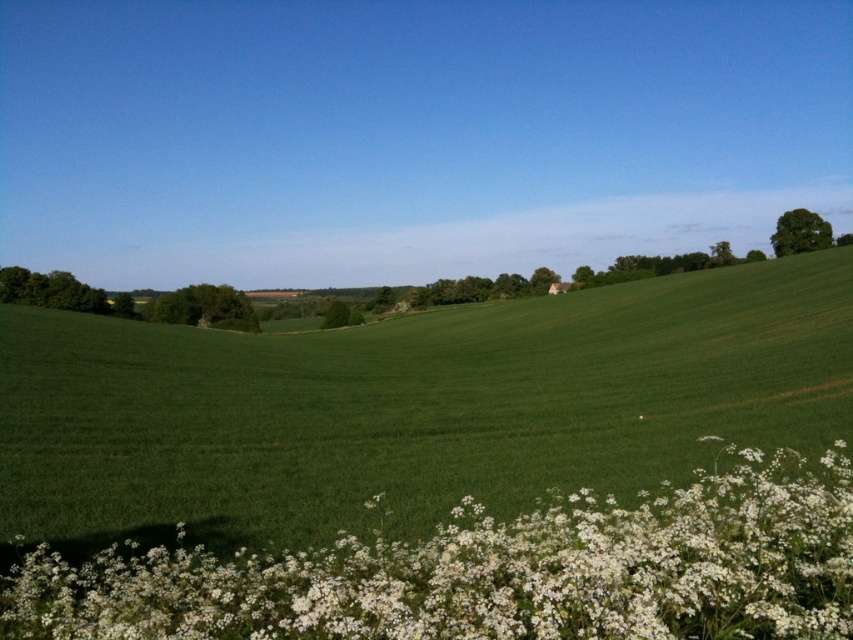
Measure the distance between point (297, 509) and camera.

They are 12.61 meters apart.

Does green grassy field at center appear under white fluffy flowers at lower center?

Actually, green grassy field at center is above white fluffy flowers at lower center.

Identify the location of green grassy field at center. (409, 406).